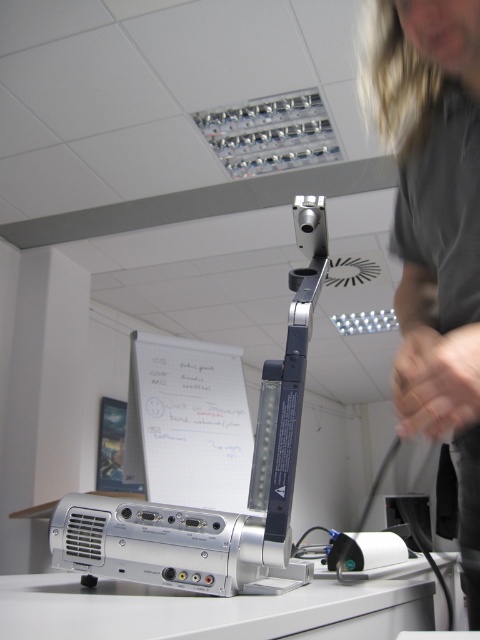
You are organizing a presentation in the office and need to ensure that the gray fabric shirt at upper right and the silver metallic table at lower center are visible to the audience. Which object should you position closer to the front of the room to ensure both are visible?

The gray fabric shirt at upper right is located above the silver metallic table at lower center. To ensure both are visible, position the silver metallic table at lower center closer to the front since it is below the shirt, allowing the shirt to be seen above it without obstruction.

You are standing in the office and want to reach the point labeled as point (x=78, y=499) on the whiteboard. If your arm can extend 80 centimeters, can you reach it?

The point (x=78, y=499) is 85.59 centimeters away from the viewer. Since your arm can only extend 80 centimeters, you cannot reach it without moving closer.

You are standing in the office scene. You need to locate the gray fabric shirt at upper right. Where exactly is it positioned in terms of coordinates?

The gray fabric shirt at upper right is located at the coordinates point (435, 228).